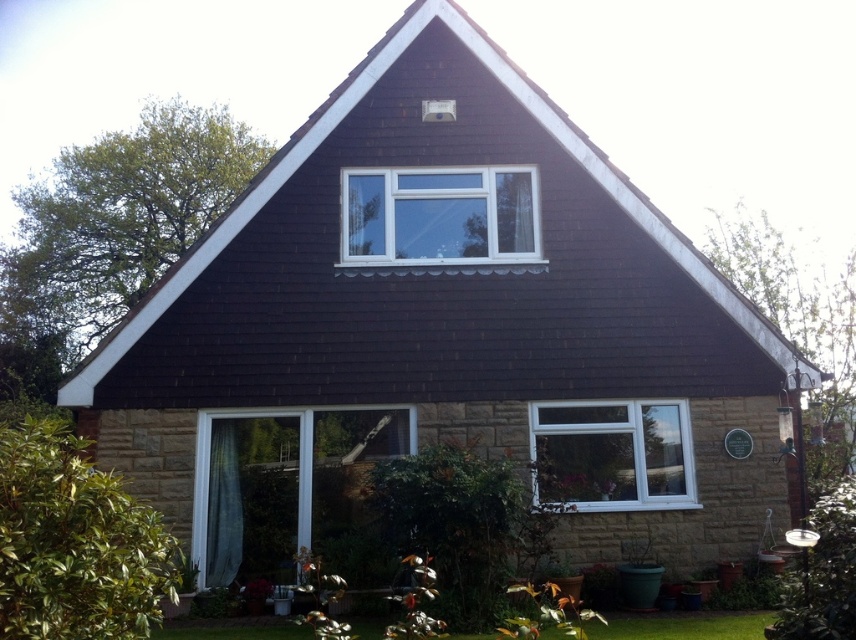
Question: Can you confirm if white plastic window at lower right is smaller than green grass at lower center?

Choices:
 (A) yes
 (B) no

Answer: (B)

Question: Which is farther from the white plastic window at lower right?

Choices:
 (A) green grass at lower center
 (B) white plastic window at center
 (C) transparent glass window at lower center

Answer: (C)

Question: Estimate the real-world distances between objects in this image. Which object is closer to the transparent glass window at lower center?

Choices:
 (A) white plastic window at lower right
 (B) green grass at lower center

Answer: (A)

Question: Which of these objects is positioned closest to the transparent glass window at lower center?

Choices:
 (A) white plastic window at lower right
 (B) white plastic window at center

Answer: (B)

Question: Does transparent glass window at lower center have a greater width compared to white plastic window at lower right?

Choices:
 (A) no
 (B) yes

Answer: (B)

Question: Is white plastic window at lower right behind green grass at lower center?

Choices:
 (A) no
 (B) yes

Answer: (B)